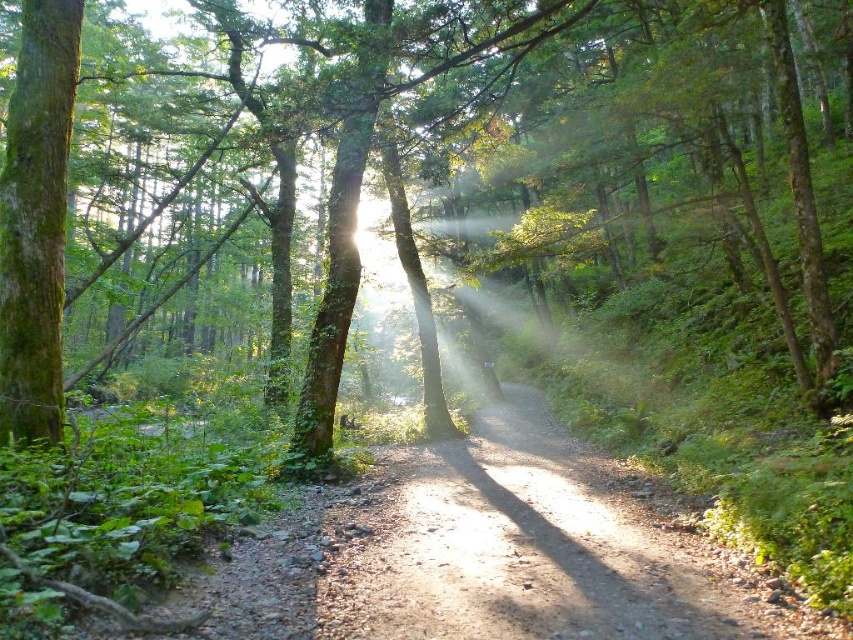
Question: Which of the following is the closest to the observer?

Choices:
 (A) (677, 637)
 (B) (16, 244)

Answer: (A)

Question: Is green mossy tree at center bigger than dirt path at center?

Choices:
 (A) yes
 (B) no

Answer: (A)

Question: Is green mossy tree at center positioned in front of dirt path at center?

Choices:
 (A) no
 (B) yes

Answer: (A)

Question: Which of the following is the farthest from the observer?

Choices:
 (A) dirt path at center
 (B) green mossy tree at center

Answer: (B)

Question: Is green mossy tree at center in front of dirt path at center?

Choices:
 (A) yes
 (B) no

Answer: (B)